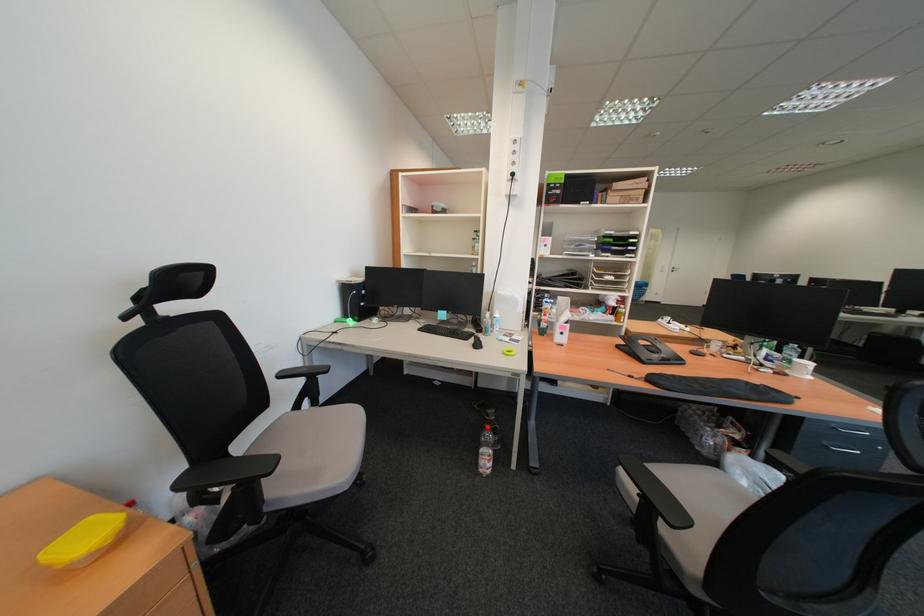
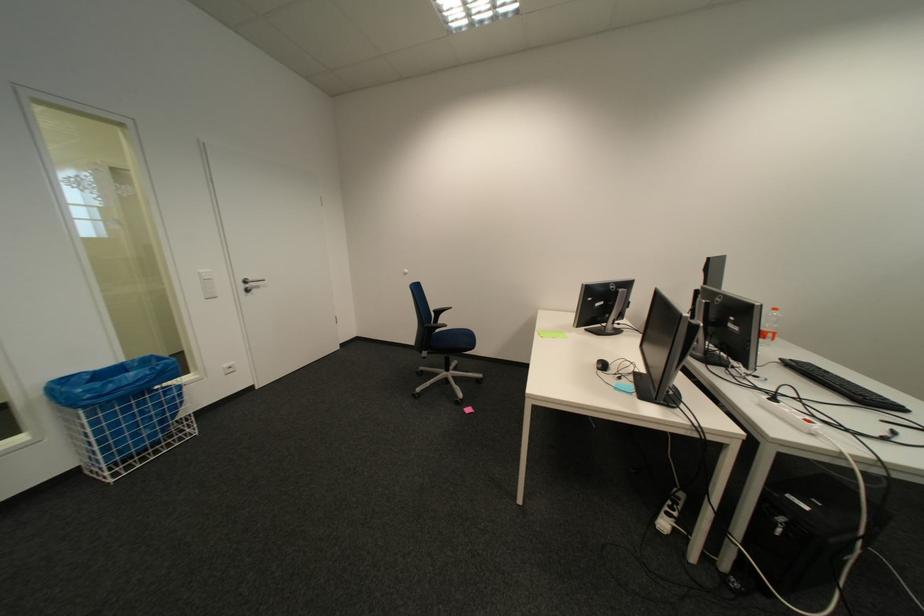
Find the pixel in the second image that matches point (684, 270) in the first image.

(254, 286)